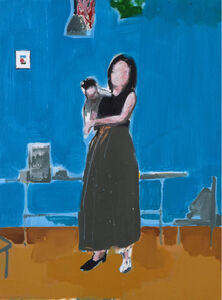
At what (x,y) coordinates should I click in order to perform the action: click on green splotch at the top of the painting. Please return your answer as a coordinate pair (x, y). Looking at the image, I should click on (126, 10).